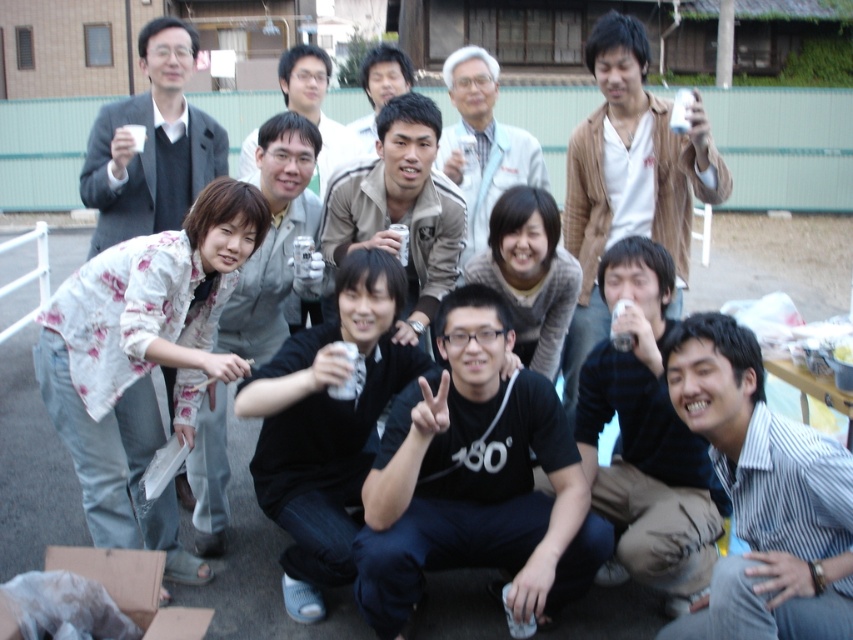
Can you confirm if black shirt at center is positioned below light blue fabric shirt at center?

Yes.

Find the location of a particular element. This screenshot has width=853, height=640. black shirt at center is located at coordinates (276, 241).

Between point (303, 195) and point (473, 234), which one is positioned behind?

Point (473, 234)

The image size is (853, 640). I want to click on black shirt at center, so pyautogui.click(x=276, y=241).

Is black matte t-shirt at center closer to the viewer compared to khaki fabric jacket at center?

That is True.

Is black matte t-shirt at center thinner than khaki fabric jacket at center?

No, black matte t-shirt at center is not thinner than khaki fabric jacket at center.

This screenshot has height=640, width=853. Describe the element at coordinates (474, 481) in the screenshot. I see `black matte t-shirt at center` at that location.

You are a GUI agent. You are given a task and a screenshot of the screen. Output one action in this format:
    pyautogui.click(x=<x>, y=<y>)
    Task: Click on the black matte t-shirt at center
    This screenshot has height=640, width=853.
    Given the screenshot: What is the action you would take?
    pyautogui.click(x=474, y=481)

Is dark blue sweater at center taller than matte black shirt at center?

Yes, dark blue sweater at center is taller than matte black shirt at center.

Is dark blue sweater at center thinner than matte black shirt at center?

No, dark blue sweater at center is not thinner than matte black shirt at center.

Is point (672, 477) more distant than point (322, 192)?

No.

Find the location of a particular element. The image size is (853, 640). dark blue sweater at center is located at coordinates (645, 438).